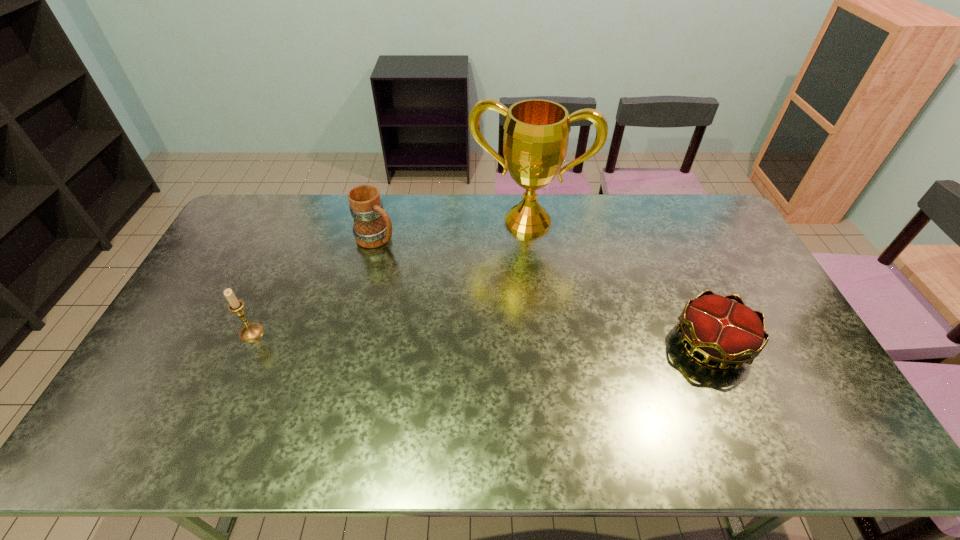
Where is `vacant area between the shortest object and the third object from right to left`? The width and height of the screenshot is (960, 540). vacant area between the shortest object and the third object from right to left is located at coordinates (544, 291).

You are a GUI agent. You are given a task and a screenshot of the screen. Output one action in this format:
    pyautogui.click(x=<x>, y=<y>)
    Task: Click on the free area in between the shortest object and the second object from left to right
    This screenshot has height=540, width=960.
    Given the screenshot: What is the action you would take?
    pyautogui.click(x=544, y=291)

Locate an element on the screen. This screenshot has height=540, width=960. empty location between the crown and the third object from right to left is located at coordinates (544, 291).

The image size is (960, 540). I want to click on object that can be found as the second closest to the third object from right to left, so click(251, 331).

Identify which object is the third nearest to the award. Please provide its 2D coordinates. Your answer should be formatted as a tuple, i.e. [(x, y)], where the tuple contains the x and y coordinates of a point satisfying the conditions above.

[(251, 331)]

Locate an element on the screen. This screenshot has width=960, height=540. vacant point that satisfies the following two spatial constraints: 1. on the back side of the candle holder; 2. on the right side of the mug is located at coordinates (294, 239).

The width and height of the screenshot is (960, 540). In order to click on vacant area that satisfies the following two spatial constraints: 1. on the front side of the award; 2. on the right side of the rightmost object in this screenshot , I will do `click(542, 344)`.

Where is `vacant space that satisfies the following two spatial constraints: 1. on the back side of the mug; 2. on the left side of the leftmost object`? vacant space that satisfies the following two spatial constraints: 1. on the back side of the mug; 2. on the left side of the leftmost object is located at coordinates (294, 239).

Identify the location of vacant space that satisfies the following two spatial constraints: 1. on the back side of the third object from left to right; 2. on the right side of the leftmost object. (301, 221).